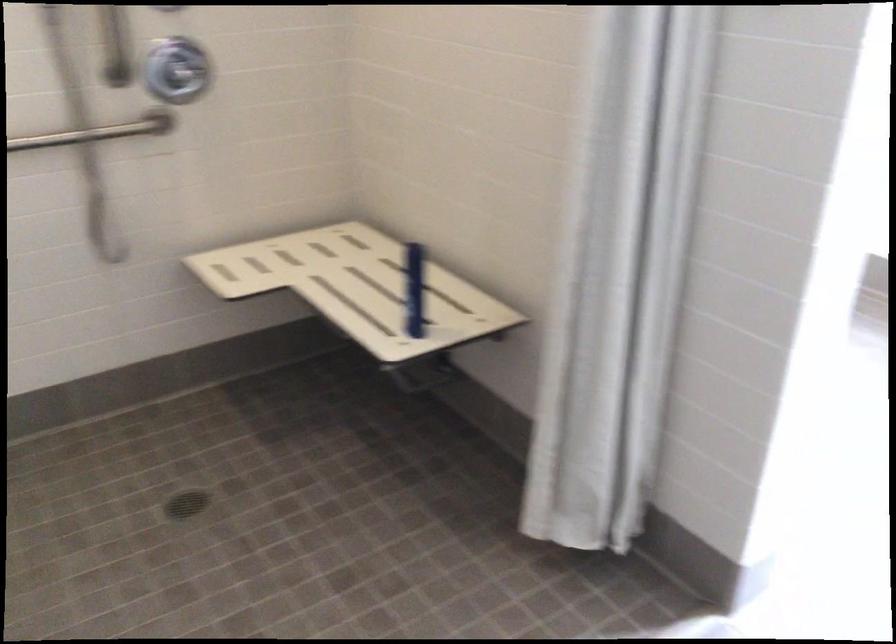
Where is `chrome shower dial`? Image resolution: width=896 pixels, height=644 pixels. chrome shower dial is located at coordinates (186, 75).